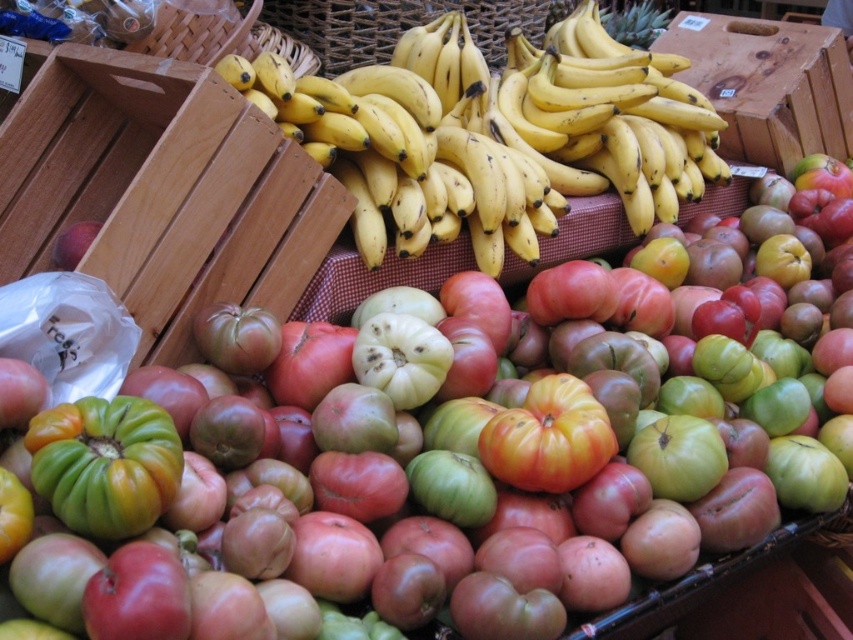
Image resolution: width=853 pixels, height=640 pixels. Find the location of `wooden crate at upper right`. wooden crate at upper right is located at coordinates (769, 84).

Does wooden crate at upper left appear over wooden crate at upper right?

No.

Between wooden crate at upper left and wooden crate at upper right, which one has more height?

With more height is wooden crate at upper right.

I want to click on wooden crate at upper left, so click(x=161, y=189).

Looking at this image, which is more to the left, wooden crate at upper left or ripe red tomato at center?

wooden crate at upper left is more to the left.

Is point (10, 241) closer to camera compared to point (579, 413)?

No, it is behind (579, 413).

The height and width of the screenshot is (640, 853). Identify the location of wooden crate at upper left. (161, 189).